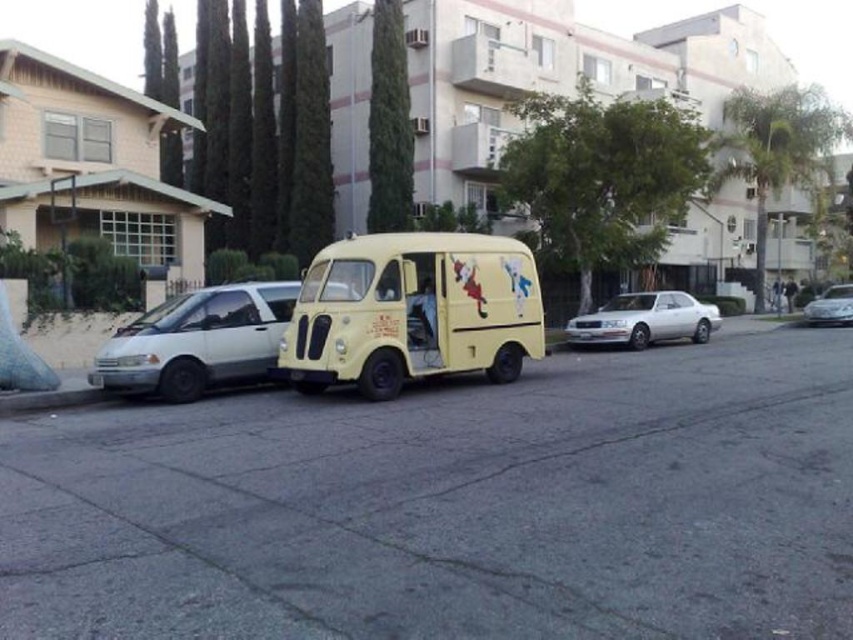
Does point (260, 364) come closer to viewer compared to point (608, 323)?

Yes, point (260, 364) is in front of point (608, 323).

From the picture: Does white matte van at center have a smaller size compared to white metallic sedan at center-right?

Correct, white matte van at center occupies less space than white metallic sedan at center-right.

Between point (227, 307) and point (624, 307), which one is positioned behind?

The point (624, 307) is more distant.

The image size is (853, 640). I want to click on white matte van at center, so click(x=198, y=340).

The height and width of the screenshot is (640, 853). What do you see at coordinates (412, 310) in the screenshot?
I see `yellow matte van at center` at bounding box center [412, 310].

Does yellow matte van at center lie behind white metallic sedan at center-right?

No, yellow matte van at center is closer to the viewer.

Which is behind, point (479, 342) or point (624, 298)?

The point (624, 298) is more distant.

Find the location of a particular element. The width and height of the screenshot is (853, 640). yellow matte van at center is located at coordinates (412, 310).

Is white matte van at center thinner than metallic silver sedan at center?

Yes, white matte van at center is thinner than metallic silver sedan at center.

Between point (213, 352) and point (822, 307), which one is positioned in front?

Point (213, 352)

Find the location of `white matte van at center`. white matte van at center is located at coordinates (198, 340).